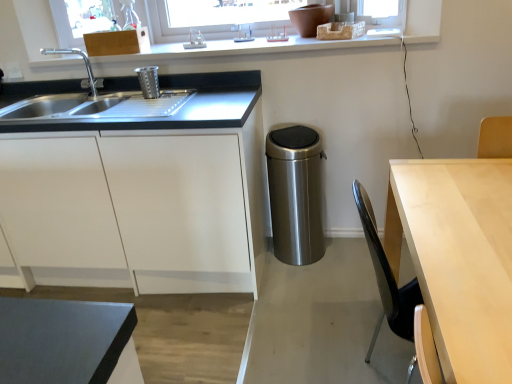
Question: Is white plastic window frame at upper center inside the boundaries of satin steel sink at left, or outside?

Choices:
 (A) inside
 (B) outside

Answer: (B)

Question: Is white plastic window frame at upper center wider or thinner than satin steel sink at left?

Choices:
 (A) wide
 (B) thin

Answer: (A)

Question: Which of these objects is positioned farthest from the brushed metal faucet at left?

Choices:
 (A) white matte cabinet at left, the 1th cabinetry positioned from the bottom
 (B) wooden cutting board at upper left, arranged as the 2th cabinetry when ordered from the bottom
 (C) stainless steel trash can at center, which is the first appliance in right-to-left order
 (D) light wood table at right
 (E) brushed metal trash can at upper left, the 1th appliance in the left-to-right sequence

Answer: (D)

Question: Considering the real-world distances, which object is closest to the brushed metal trash can at upper left, the 1th appliance in the left-to-right sequence?

Choices:
 (A) stainless steel trash can at center, which is the first appliance in right-to-left order
 (B) wooden cutting board at upper left, arranged as the 2th cabinetry when ordered from the bottom
 (C) satin steel sink at left
 (D) white plastic window frame at upper center
 (E) light wood table at right

Answer: (B)